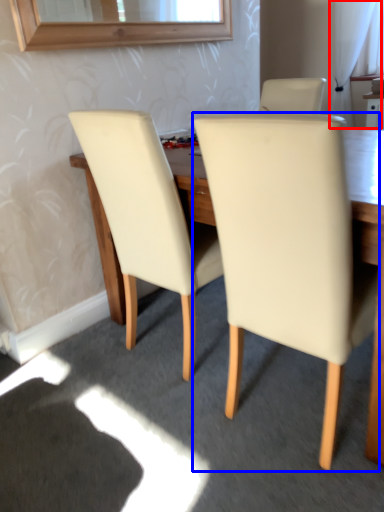
Question: Which point is closer to the camera, curtain (highlighted by a red box) or chair (highlighted by a blue box)?

Choices:
 (A) curtain
 (B) chair

Answer: (B)